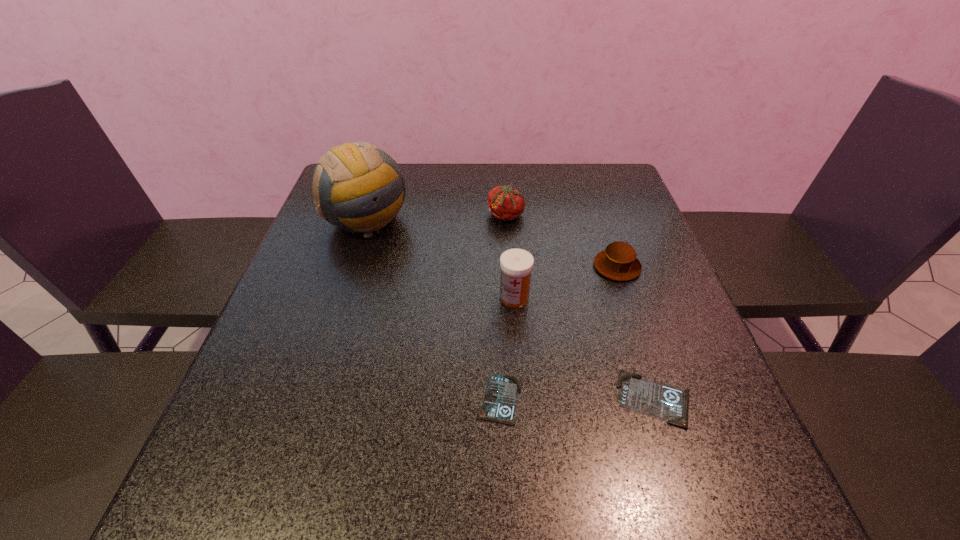
This screenshot has width=960, height=540. I want to click on the left identity card, so click(x=499, y=403).

Identify the location of the shorter identity card. This screenshot has height=540, width=960. (499, 403).

Image resolution: width=960 pixels, height=540 pixels. Find the location of `the taller identity card`. the taller identity card is located at coordinates (648, 397).

Find the location of a particular element. Image resolution: width=960 pixels, height=540 pixels. the fifth tallest object is located at coordinates (648, 397).

Find the location of a particular element. This screenshot has width=960, height=540. the tallest object is located at coordinates (359, 187).

The height and width of the screenshot is (540, 960). Find the location of `the leftmost object`. the leftmost object is located at coordinates (359, 187).

This screenshot has width=960, height=540. I want to click on tomato, so click(505, 203).

Locate an element on the screen. the third shortest object is located at coordinates (618, 261).

Locate an element on the screen. the third farthest object is located at coordinates (618, 261).

At what (x,y) coordinates should I click in order to perform the action: click on the third nearest object. Please return your answer as a coordinate pair (x, y). This screenshot has height=540, width=960. Looking at the image, I should click on (x=516, y=265).